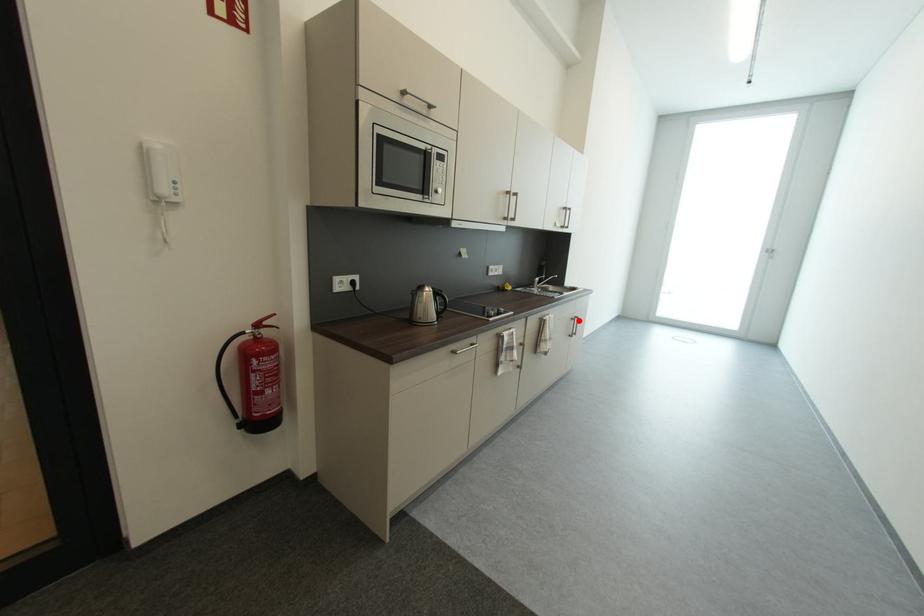
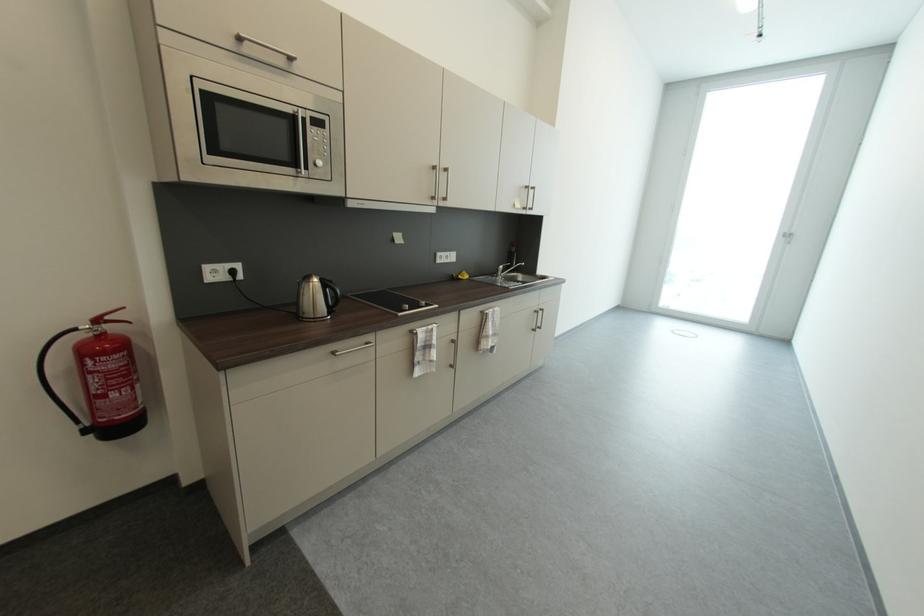
Find the pixel in the second image that matches the highlighted location in the first image.

(541, 313)